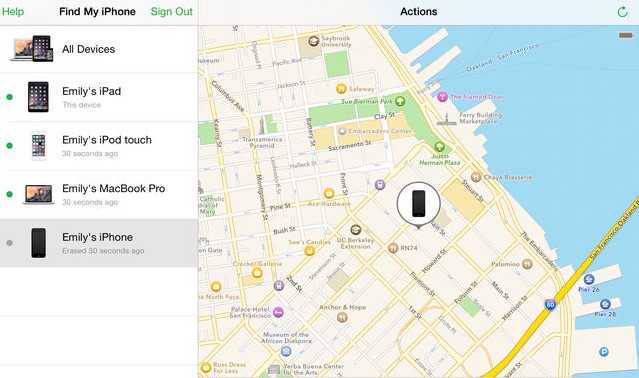
Find the location of `computers`. computers is located at coordinates (39, 195), (20, 46).